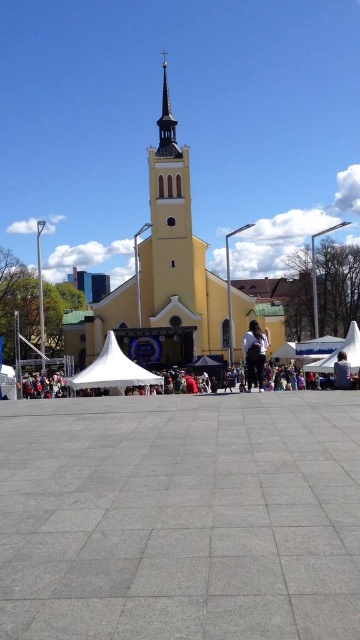
Question: Can you confirm if yellow matte church at center is thinner than white cotton shirt at center?

Choices:
 (A) yes
 (B) no

Answer: (B)

Question: Is yellow matte church at center thinner than white fabric canopy at lower right?

Choices:
 (A) yes
 (B) no

Answer: (B)

Question: Which of the following is the farthest from the observer?

Choices:
 (A) tap(165, 113)
 (B) tap(349, 387)
 (C) tap(137, 371)
 (D) tap(351, 326)

Answer: (A)

Question: Among these points, which one is nearest to the camera?

Choices:
 (A) (180, 154)
 (B) (347, 362)
 (C) (253, 348)

Answer: (B)

Question: Which point appears closest to the camera in this image?

Choices:
 (A) (133, 337)
 (B) (358, 348)
 (C) (167, 129)
 (D) (254, 358)

Answer: (D)

Question: Does white fabric canopy at lower left appear over white fabric canopy at lower right?

Choices:
 (A) no
 (B) yes

Answer: (A)